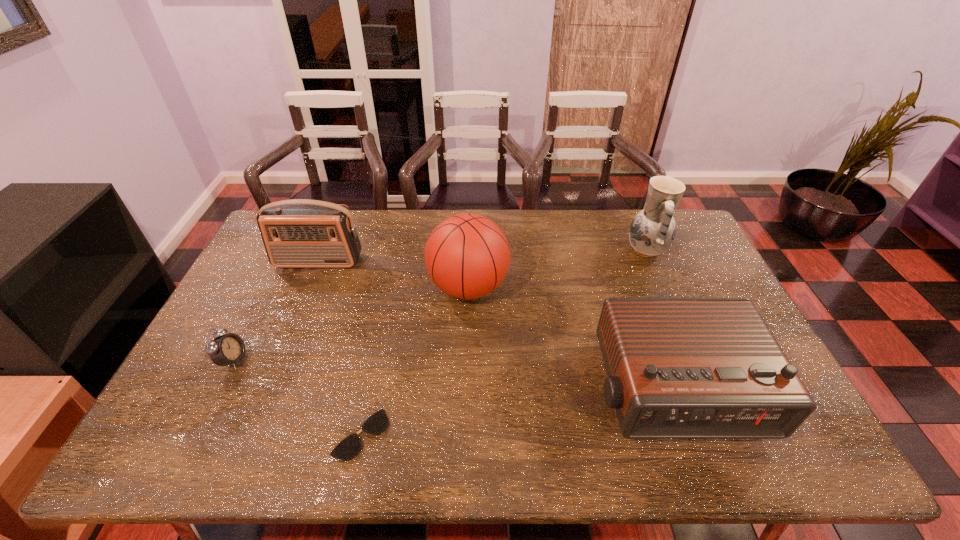
This screenshot has height=540, width=960. I want to click on pottery that is at the right edge, so tap(652, 231).

Locate an element on the screen. The height and width of the screenshot is (540, 960). radio receiver positioned at the right edge is located at coordinates (677, 367).

At what (x,y) coordinates should I click in order to perform the action: click on object at the far right corner. Please return your answer as a coordinate pair (x, y). This screenshot has height=540, width=960. Looking at the image, I should click on (652, 231).

Identify the location of object located at the near right corner. Image resolution: width=960 pixels, height=540 pixels. (677, 367).

Where is `vacant area at the far edge of the desktop`? This screenshot has width=960, height=540. vacant area at the far edge of the desktop is located at coordinates (402, 222).

In the image, there is a desktop. Where is `free space at the near edge`? free space at the near edge is located at coordinates (385, 449).

Locate an element on the screen. The image size is (960, 540). free region at the left edge of the desktop is located at coordinates (251, 276).

Identify the location of vacant space at the near left corner. (173, 455).

In order to click on free space at the far right corner of the desktop in this screenshot , I will do coord(686,249).

In order to click on free space that is in between the shortest object and the pottery in this screenshot , I will do `click(503, 342)`.